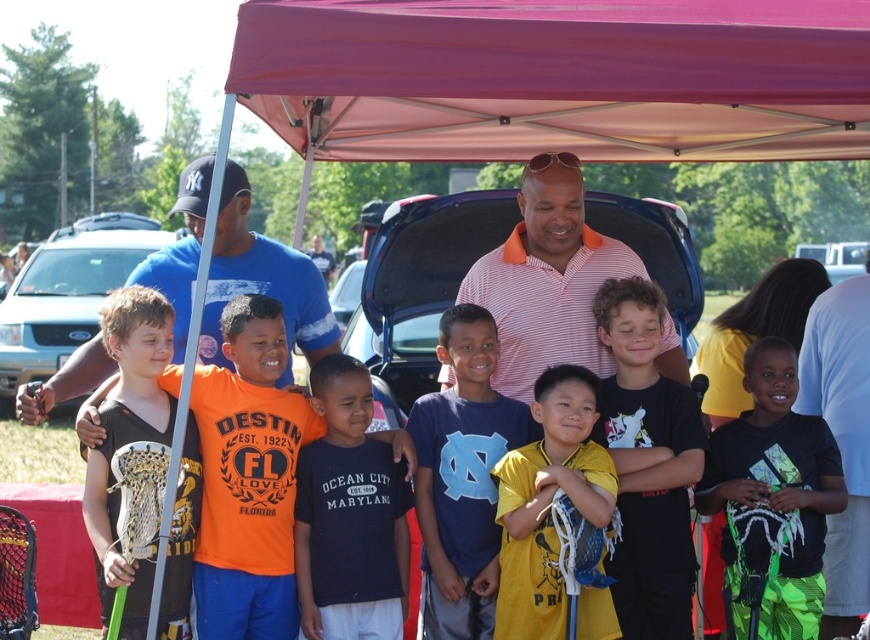
Question: Can you confirm if pink fabric canopy at upper center is bigger than black matte shirt at center?

Choices:
 (A) yes
 (B) no

Answer: (B)

Question: Is yellow matte shirt at center thinner than matte black lacrosse stick at left?

Choices:
 (A) yes
 (B) no

Answer: (B)

Question: Which object is the farthest from the blue cotton t-shirt at left?

Choices:
 (A) yellow matte shirt at center
 (B) matte black lacrosse stick at left
 (C) matte black lacrosse stick at center

Answer: (A)

Question: Which of the following is the farthest from the observer?

Choices:
 (A) dark blue jersey at center
 (B) yellow matte shirt at center
 (C) blue matte car at left

Answer: (C)

Question: Is matte black lacrosse stick at center further to camera compared to green mesh shorts at center?

Choices:
 (A) no
 (B) yes

Answer: (A)

Question: Which object is the farthest from the pink fabric canopy at upper center?

Choices:
 (A) dark blue jersey at center
 (B) black matte shirt at center

Answer: (B)